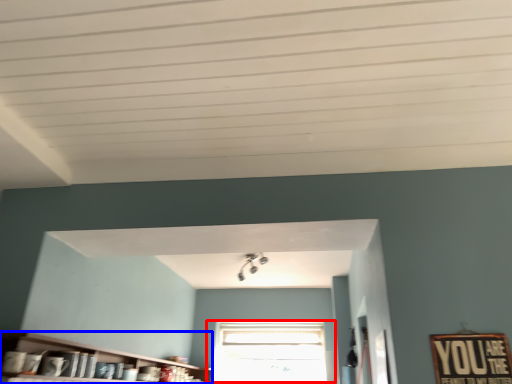
Question: Which point is closer to the camera, window (highlighted by a red box) or shelf (highlighted by a blue box)?

Choices:
 (A) window
 (B) shelf

Answer: (B)